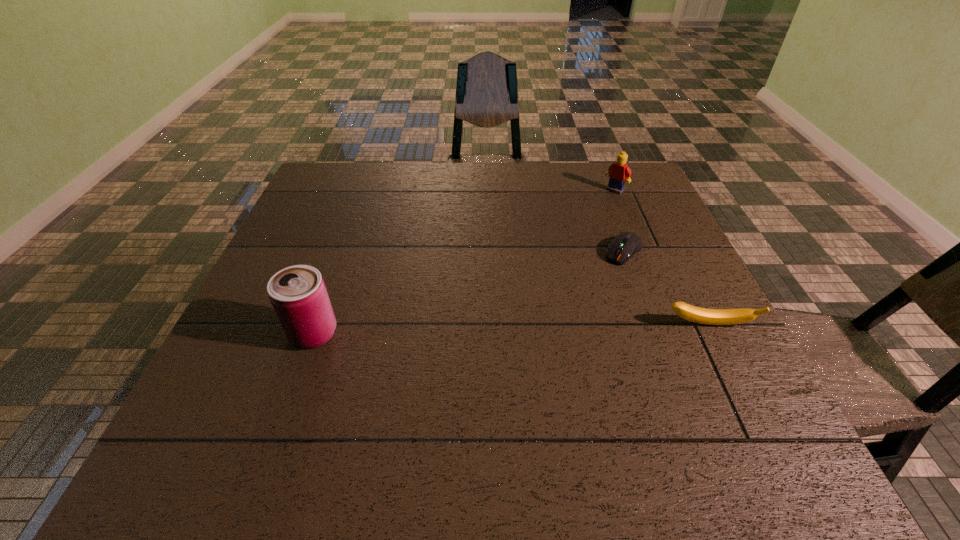
You are a GUI agent. You are given a task and a screenshot of the screen. Output one action in this format:
    pyautogui.click(x=<x>, y=<y>)
    Task: Click on the free space located 0.240m on the button of the computer equipment
    This screenshot has width=960, height=540.
    Given the screenshot: What is the action you would take?
    pyautogui.click(x=565, y=320)

This screenshot has width=960, height=540. What are the coordinates of `vacant space positioned 0.270m on the button of the computer equipment` in the screenshot? It's located at (559, 328).

At what (x,y) coordinates should I click in order to perform the action: click on free region located 0.400m on the front-facing side of the Lego. Please return your answer as a coordinate pair (x, y). This screenshot has width=960, height=540. Looking at the image, I should click on (539, 264).

At what (x,y) coordinates should I click in order to perform the action: click on free space located on the front-facing side of the Lego. Please return your answer as a coordinate pair (x, y). The width and height of the screenshot is (960, 540). Looking at the image, I should click on (592, 211).

I want to click on free space located on the front-facing side of the Lego, so click(539, 264).

In order to click on object that is at the far edge in this screenshot , I will do `click(618, 171)`.

At what (x,y) coordinates should I click in order to perform the action: click on object that is at the left edge. Please return your answer as a coordinate pair (x, y). The height and width of the screenshot is (540, 960). Looking at the image, I should click on (298, 294).

The width and height of the screenshot is (960, 540). What are the coordinates of `banana present at the right edge` in the screenshot? It's located at (688, 312).

Locate an element on the screen. This screenshot has width=960, height=540. computer equipment positioned at the right edge is located at coordinates (625, 245).

This screenshot has height=540, width=960. In order to click on Lego positioned at the right edge in this screenshot , I will do `click(618, 171)`.